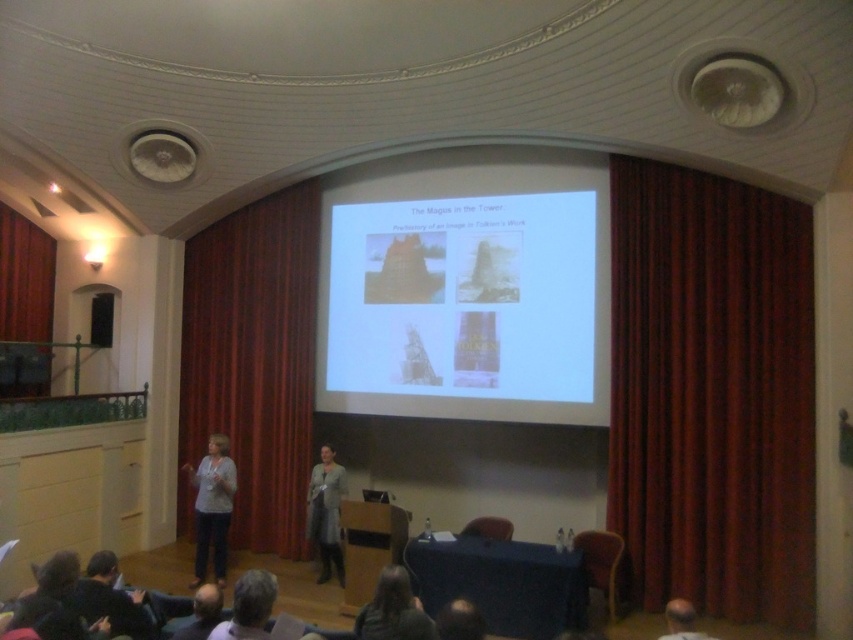
Question: Can you confirm if red velvet curtain at center is positioned above bald head at center?

Choices:
 (A) yes
 (B) no

Answer: (A)

Question: Which is farther from the velvet dark red curtain at left?

Choices:
 (A) white paper at center
 (B) red velvet curtain at center
 (C) dark gray sweater at lower left

Answer: (C)

Question: Considering the real-world distances, which object is closest to the white paper at center?

Choices:
 (A) velvet dark red curtain at left
 (B) red velvet curtain at center

Answer: (B)

Question: Does white paper at center have a larger size compared to red velvet curtain at center?

Choices:
 (A) yes
 (B) no

Answer: (A)

Question: Is gray woolen sweater at center in front of smooth bald head at lower left?

Choices:
 (A) yes
 (B) no

Answer: (B)

Question: Which object appears closest to the camera in this image?

Choices:
 (A) dark red velvet curtain at right
 (B) bald head at center
 (C) dark gray sweater at lower left
 (D) white paper at center

Answer: (B)